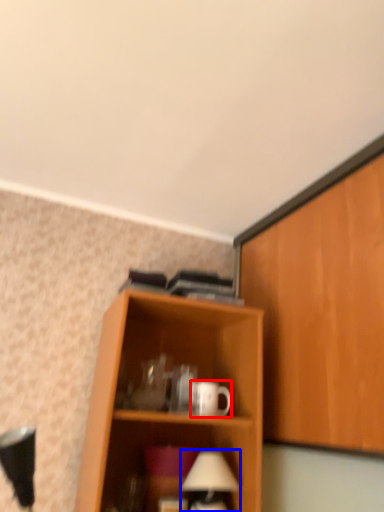
Question: Which of the following is the closest to the observer, mug (highlighted by a red box) or table lamp (highlighted by a blue box)?

Choices:
 (A) mug
 (B) table lamp

Answer: (B)